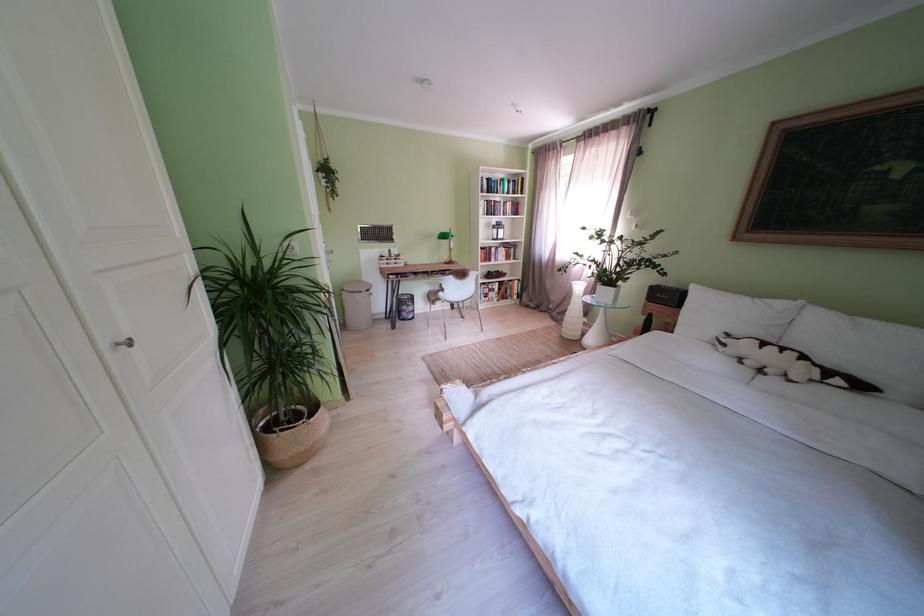
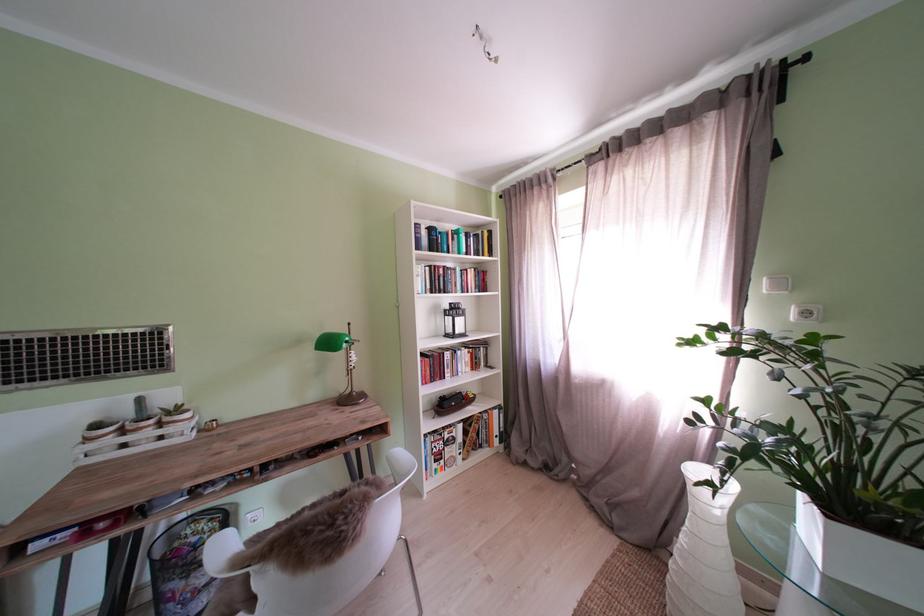
In the second image, find the point that corresponds to (502,265) in the first image.

(454, 382)